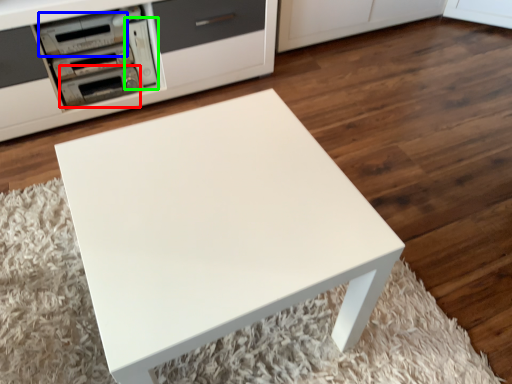
Question: Estimate the real-world distances between objects in this image. Which object is farther from appliance (highlighted by a red box), appliance (highlighted by a blue box) or appliance (highlighted by a green box)?

Choices:
 (A) appliance
 (B) appliance

Answer: (A)